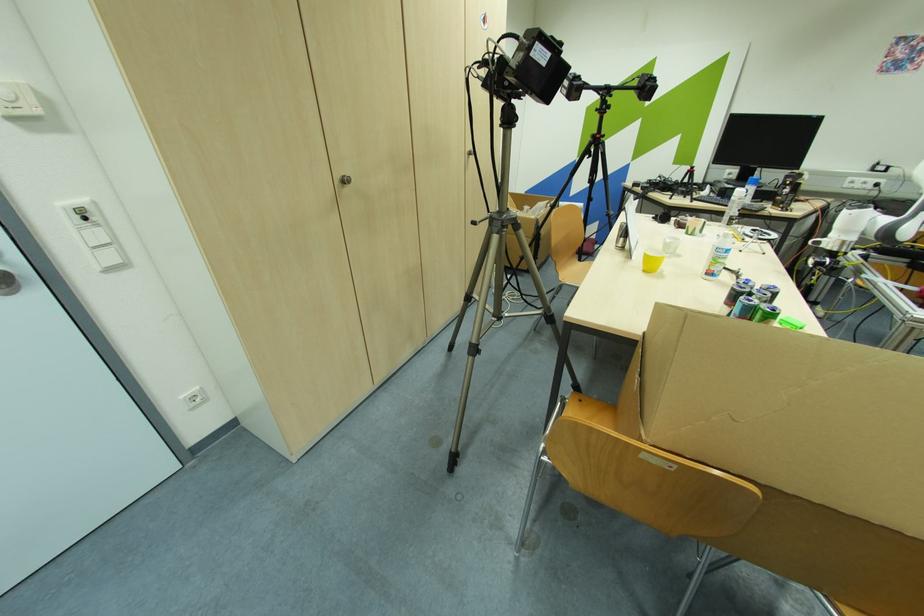
What do you see at coordinates (738, 193) in the screenshot? The image size is (924, 616). I see `a spray bottle trigger` at bounding box center [738, 193].